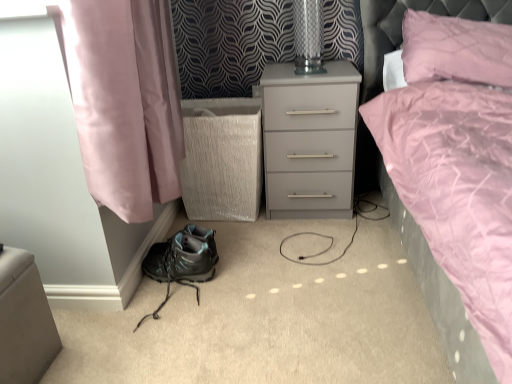
Where is `spots to the right of matte black hiking boot at lower left`? The width and height of the screenshot is (512, 384). spots to the right of matte black hiking boot at lower left is located at coordinates (234, 261).